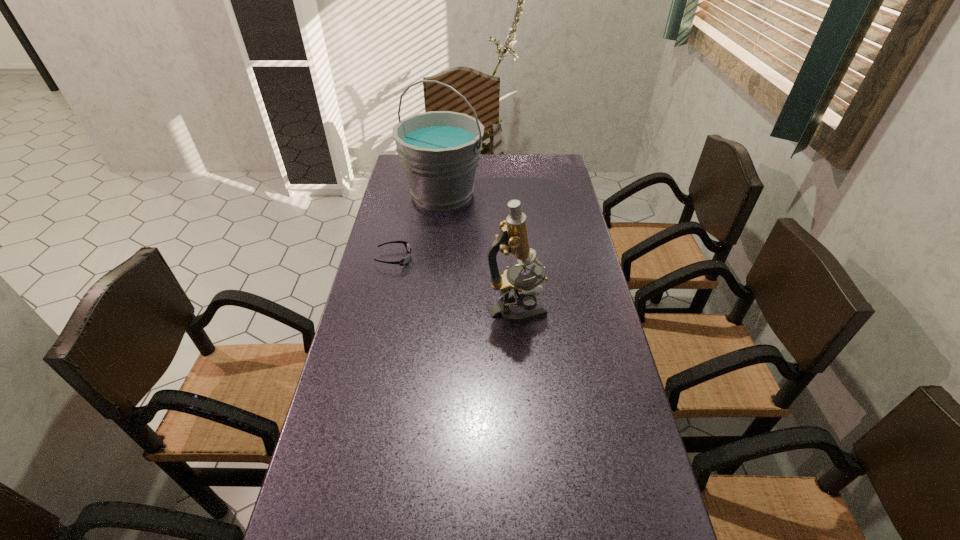
Where is `the farthest object`? the farthest object is located at coordinates (439, 150).

Identify the location of bucket. (439, 150).

At what (x,y) coordinates should I click in order to perform the action: click on the second tallest object. Please return your answer as a coordinate pair (x, y). Looking at the image, I should click on (513, 238).

The width and height of the screenshot is (960, 540). Find the location of `the rightmost object`. the rightmost object is located at coordinates (513, 238).

The width and height of the screenshot is (960, 540). What are the coordinates of `the second farthest object` in the screenshot? It's located at (404, 261).

Locate an element on the screen. The image size is (960, 540). the shortest object is located at coordinates (404, 261).

This screenshot has width=960, height=540. In order to click on vacant region located 0.150m on the front of the bucket in this screenshot , I will do `click(437, 244)`.

This screenshot has width=960, height=540. Identify the location of free space located 0.070m on the front of the microscope. (519, 347).

Identify the location of free space located on the lenses of the second nearest object. This screenshot has height=540, width=960. (499, 259).

Where is `object present at the far edge`? The height and width of the screenshot is (540, 960). object present at the far edge is located at coordinates (439, 150).